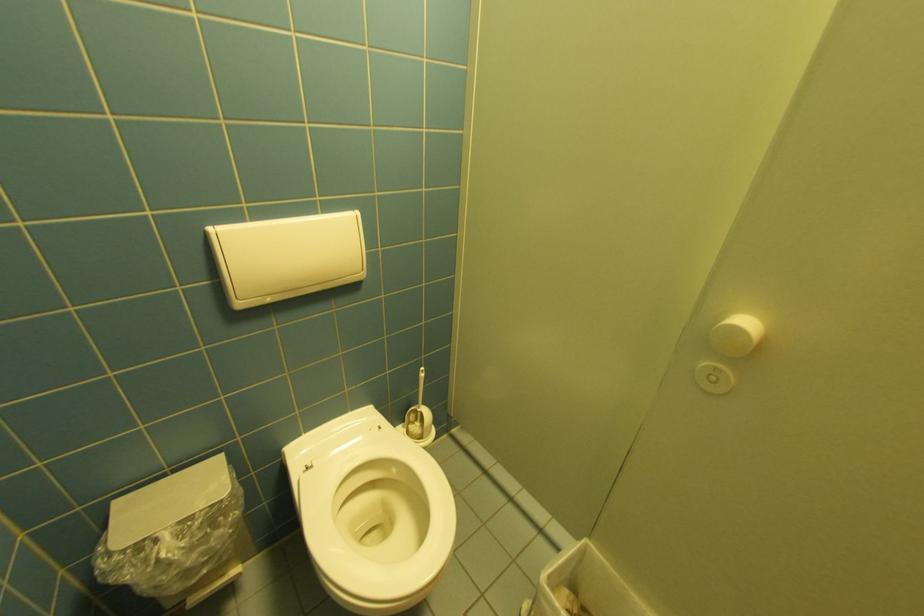
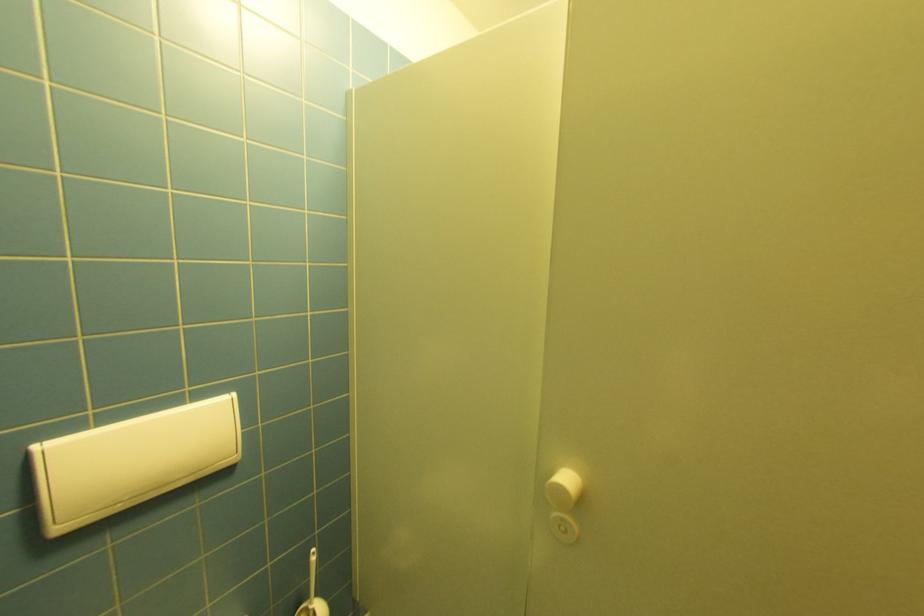
Where in the second image is the point corresponding to point (421, 411) from the first image?

(312, 610)